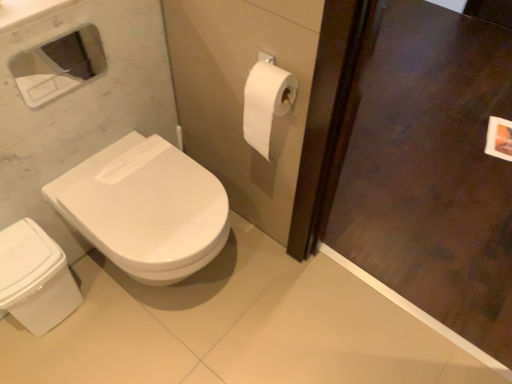
Question: Is white glossy bidet at lower left located within dark wood screen door at right?

Choices:
 (A) no
 (B) yes

Answer: (A)

Question: Can we say dark wood screen door at right lies outside white glossy bidet at lower left?

Choices:
 (A) yes
 (B) no

Answer: (A)

Question: Considering the relative positions of dark wood screen door at right and white glossy bidet at lower left in the image provided, is dark wood screen door at right to the left of white glossy bidet at lower left from the viewer's perspective?

Choices:
 (A) no
 (B) yes

Answer: (A)

Question: From a real-world perspective, is dark wood screen door at right below white glossy bidet at lower left?

Choices:
 (A) yes
 (B) no

Answer: (B)

Question: Is dark wood screen door at right directly adjacent to white glossy bidet at lower left?

Choices:
 (A) no
 (B) yes

Answer: (A)

Question: Considering the relative sizes of dark wood screen door at right and white glossy bidet at lower left in the image provided, is dark wood screen door at right smaller than white glossy bidet at lower left?

Choices:
 (A) no
 (B) yes

Answer: (A)

Question: Is white glossy toilet at lower left to the left of dark wood screen door at right from the viewer's perspective?

Choices:
 (A) no
 (B) yes

Answer: (B)

Question: Considering the relative sizes of white glossy toilet at lower left and dark wood screen door at right in the image provided, is white glossy toilet at lower left shorter than dark wood screen door at right?

Choices:
 (A) yes
 (B) no

Answer: (A)

Question: Considering the relative sizes of white glossy toilet at lower left and dark wood screen door at right in the image provided, is white glossy toilet at lower left wider than dark wood screen door at right?

Choices:
 (A) no
 (B) yes

Answer: (B)

Question: Is white glossy toilet at lower left taller than dark wood screen door at right?

Choices:
 (A) yes
 (B) no

Answer: (B)

Question: Would you consider white glossy toilet at lower left to be distant from dark wood screen door at right?

Choices:
 (A) yes
 (B) no

Answer: (A)

Question: Is the depth of white glossy toilet at lower left less than that of dark wood screen door at right?

Choices:
 (A) yes
 (B) no

Answer: (B)

Question: Is dark wood screen door at right shorter than white glossy toilet at lower left?

Choices:
 (A) no
 (B) yes

Answer: (A)